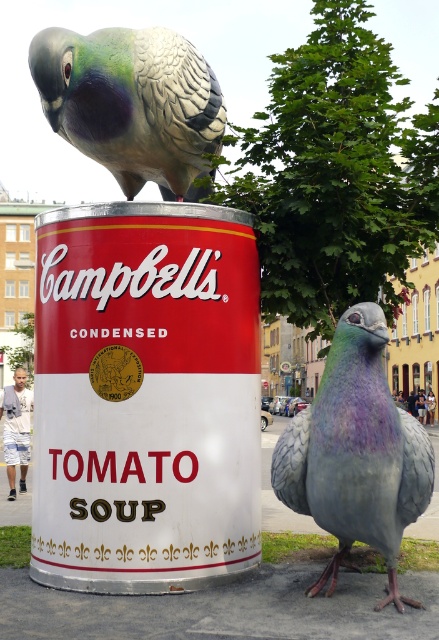
Question: Among these points, which one is farthest from the camera?

Choices:
 (A) (140, 134)
 (B) (377, 465)

Answer: (A)

Question: Does shiny metallic pigeon at center appear on the left side of green feathered parrot at upper left?

Choices:
 (A) no
 (B) yes

Answer: (A)

Question: Is shiny metallic pigeon at center closer to the viewer compared to green feathered parrot at upper left?

Choices:
 (A) yes
 (B) no

Answer: (A)

Question: Which point appears farthest from the camera in this image?

Choices:
 (A) (x=74, y=58)
 (B) (x=313, y=429)

Answer: (A)

Question: Which point is farther to the camera?

Choices:
 (A) green feathered parrot at upper left
 (B) shiny metallic pigeon at center

Answer: (A)

Question: Does shiny metallic pigeon at center have a smaller size compared to green feathered parrot at upper left?

Choices:
 (A) yes
 (B) no

Answer: (A)